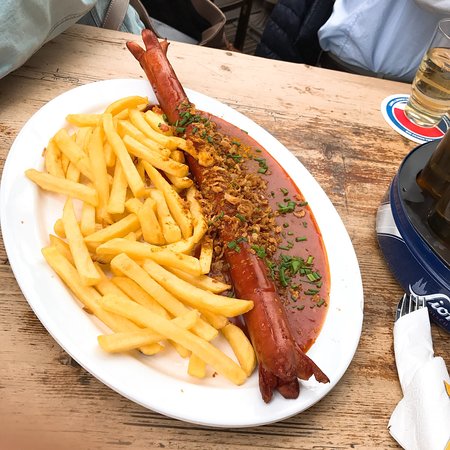
Find the location of a particular element. This screenshot has width=450, height=450. plate is located at coordinates (241, 412).